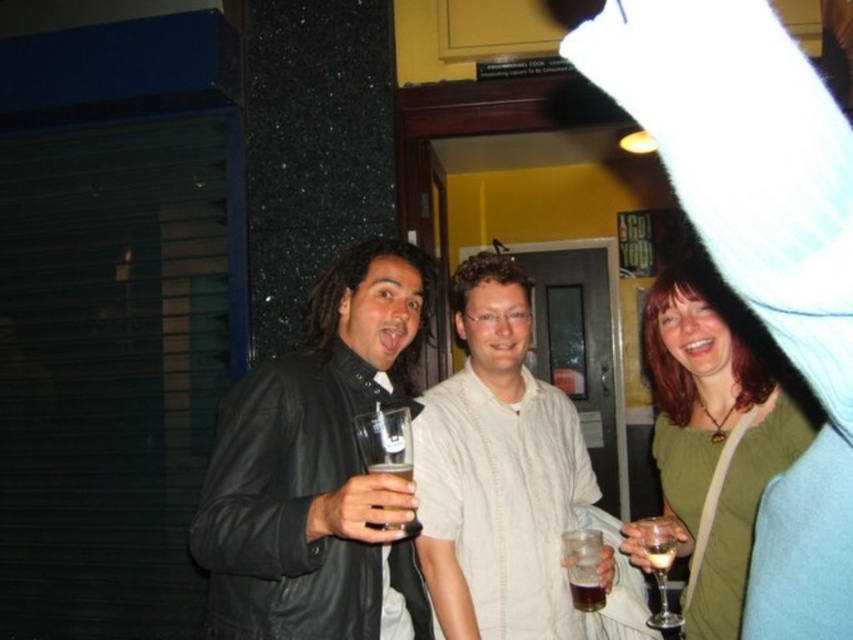
Based on the photo, you are a photographer trying to capture a group photo of the white textured shirt at center and the green matte shirt at center. Based on their positions, which person should you position slightly to the left to ensure both fit in the frame?

The white textured shirt at center is wider than the green matte shirt at center, so you should position the person in the white textured shirt at center slightly to the left to accommodate their width.

You are at a bar and want to order a drink. You see two drinks in front of you, the dark amber liquid at center and the translucent glass beer at center. Which one has a smaller volume?

The dark amber liquid at center has a smaller size compared to the translucent glass beer at center, so it has a smaller volume.